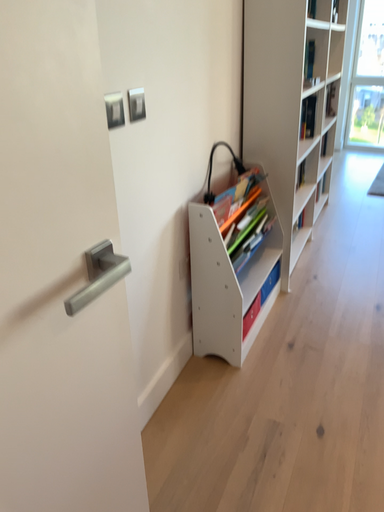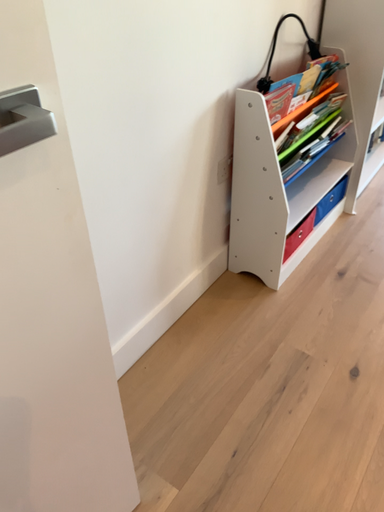
Question: How did the camera likely rotate when shooting the video?

Choices:
 (A) rotated right
 (B) rotated left

Answer: (B)